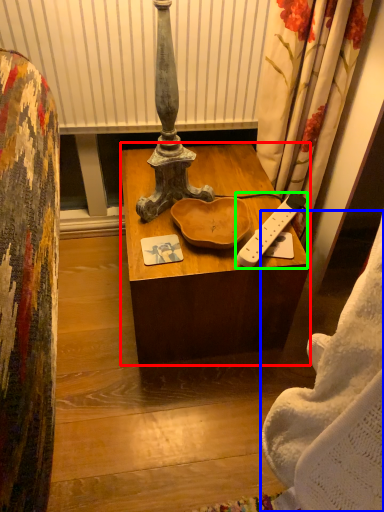
Question: Estimate the real-world distances between objects in this image. Which object is farther from desk (highlighted by a red box), blanket (highlighted by a blue box) or remote control (highlighted by a green box)?

Choices:
 (A) blanket
 (B) remote control

Answer: (A)